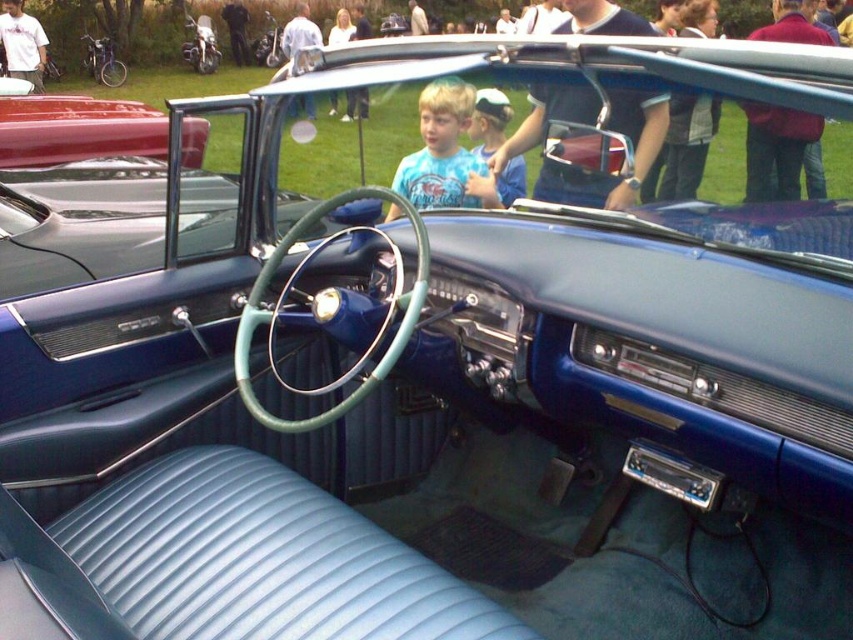
Who is positioned more to the left, blue leather dashboard at center or blue cotton shirt at center?

From the viewer's perspective, blue leather dashboard at center appears more on the left side.

Does point (107, 554) come farther from viewer compared to point (419, 97)?

No, it is not.

Find the location of a particular element. The image size is (853, 640). blue leather dashboard at center is located at coordinates (260, 560).

Find the location of `blue cotton shirt at center`. blue cotton shirt at center is located at coordinates (445, 154).

Does point (473, 186) lie behind point (486, 145)?

Yes, it is behind point (486, 145).

Locate an element on the screen. This screenshot has height=640, width=853. blue cotton shirt at center is located at coordinates (445, 154).

Is blue leather dashboard at center above blue leather cap at upper center?

No, blue leather dashboard at center is not above blue leather cap at upper center.

What do you see at coordinates (260, 560) in the screenshot? This screenshot has height=640, width=853. I see `blue leather dashboard at center` at bounding box center [260, 560].

At what (x,y) coordinates should I click in order to perform the action: click on blue leather dashboard at center. Please return your answer as a coordinate pair (x, y). Image resolution: width=853 pixels, height=640 pixels. Looking at the image, I should click on (260, 560).